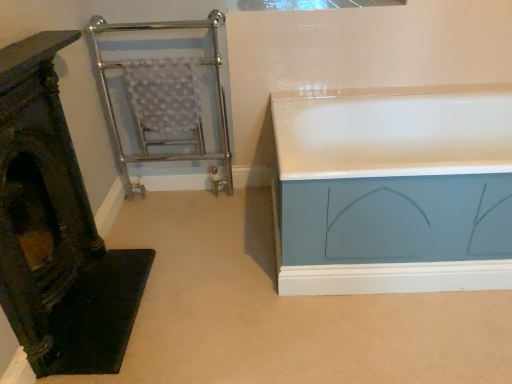
Question: Can you confirm if transparent glass window at upper center is thinner than wooden carved chair at left?

Choices:
 (A) yes
 (B) no

Answer: (B)

Question: Does transparent glass window at upper center appear on the left side of wooden carved chair at left?

Choices:
 (A) yes
 (B) no

Answer: (B)

Question: Is transparent glass window at upper center not near wooden carved chair at left?

Choices:
 (A) no
 (B) yes

Answer: (B)

Question: Is the depth of transparent glass window at upper center greater than that of wooden carved chair at left?

Choices:
 (A) yes
 (B) no

Answer: (A)

Question: From a real-world perspective, is transparent glass window at upper center on wooden carved chair at left?

Choices:
 (A) no
 (B) yes

Answer: (B)

Question: In the image, is transparent glass window at upper center positioned in front of or behind white glossy bathtub at right?

Choices:
 (A) behind
 (B) front

Answer: (A)

Question: Based on their positions, is transparent glass window at upper center located to the left or right of white glossy bathtub at right?

Choices:
 (A) left
 (B) right

Answer: (A)

Question: From their relative heights in the image, would you say transparent glass window at upper center is taller or shorter than white glossy bathtub at right?

Choices:
 (A) tall
 (B) short

Answer: (B)

Question: Does point (256, 1) appear closer or farther from the camera than point (358, 168)?

Choices:
 (A) closer
 (B) farther

Answer: (B)

Question: In terms of height, does white glossy bathtub at right look taller or shorter compared to transparent glass window at upper center?

Choices:
 (A) short
 (B) tall

Answer: (B)

Question: Considering the positions of white glossy bathtub at right and transparent glass window at upper center in the image, is white glossy bathtub at right bigger or smaller than transparent glass window at upper center?

Choices:
 (A) big
 (B) small

Answer: (A)

Question: From the image's perspective, relative to transparent glass window at upper center, is white glossy bathtub at right above or below?

Choices:
 (A) below
 (B) above

Answer: (A)

Question: Would you say white glossy bathtub at right is inside or outside transparent glass window at upper center?

Choices:
 (A) inside
 (B) outside

Answer: (B)

Question: Is chrome/metal towel rack at left inside or outside of wooden carved chair at left?

Choices:
 (A) inside
 (B) outside

Answer: (B)

Question: Is chrome/metal towel rack at left taller or shorter than wooden carved chair at left?

Choices:
 (A) tall
 (B) short

Answer: (A)